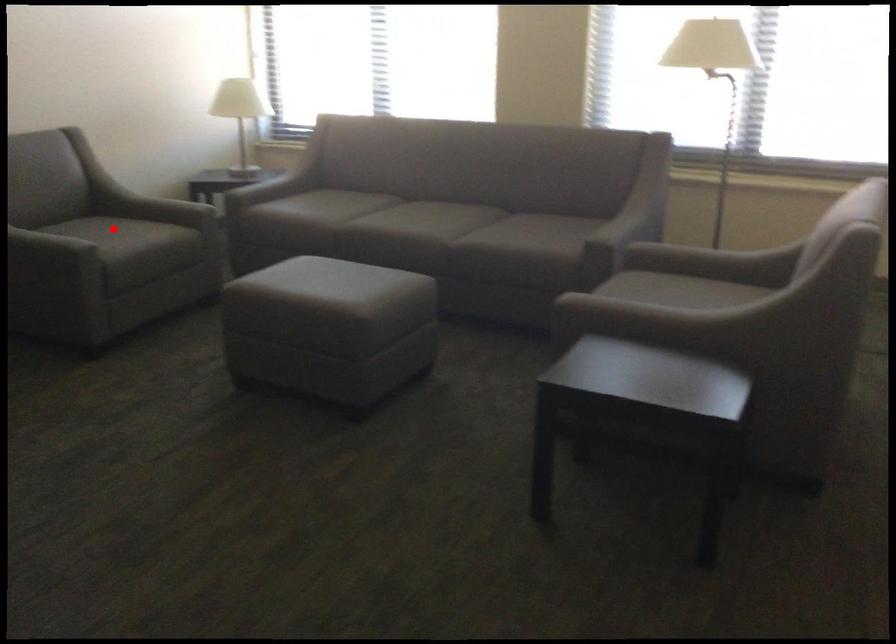
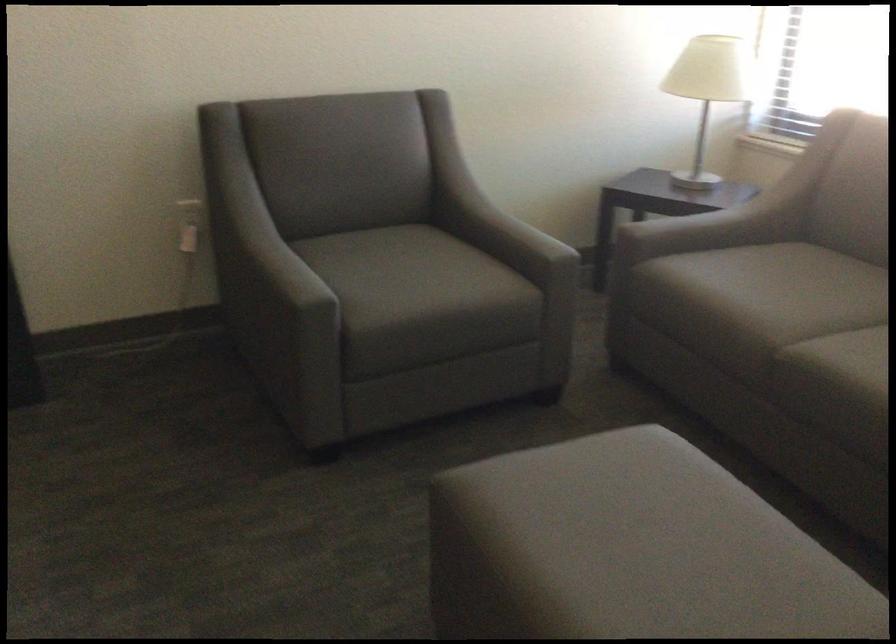
Question: I am providing you with two images of the same scene from different viewpoints. A red point is shown in image1. For the corresponding object point in image2, is it positioned nearer or farther from the camera?

Choices:
 (A) Nearer
 (B) Farther

Answer: (A)